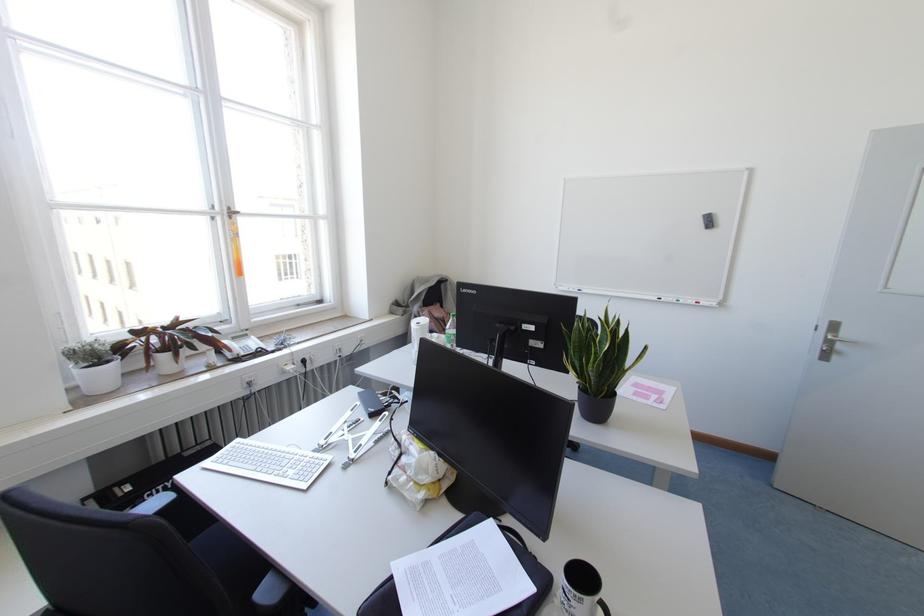
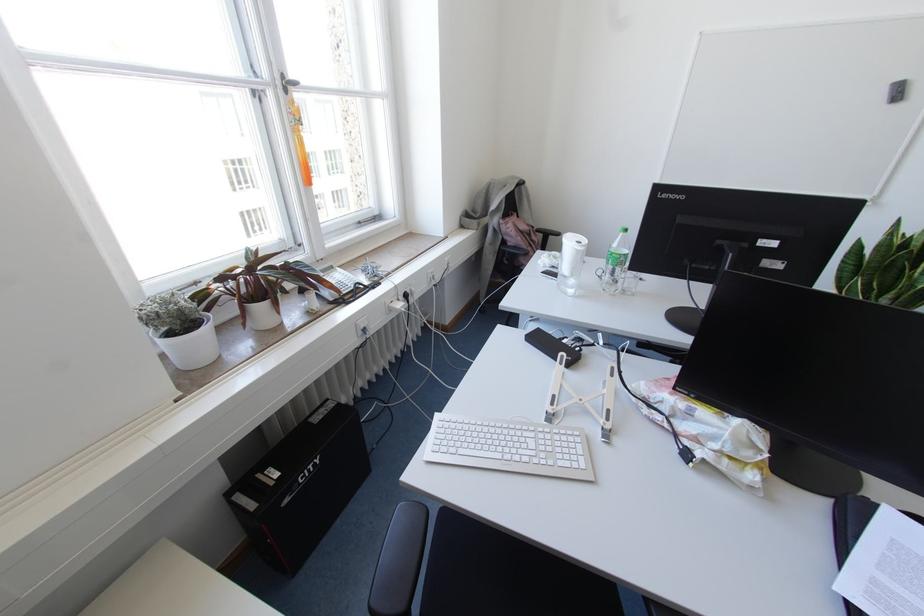
Find the pixel in the second image that matches (x=237, y=439) in the first image.

(435, 414)